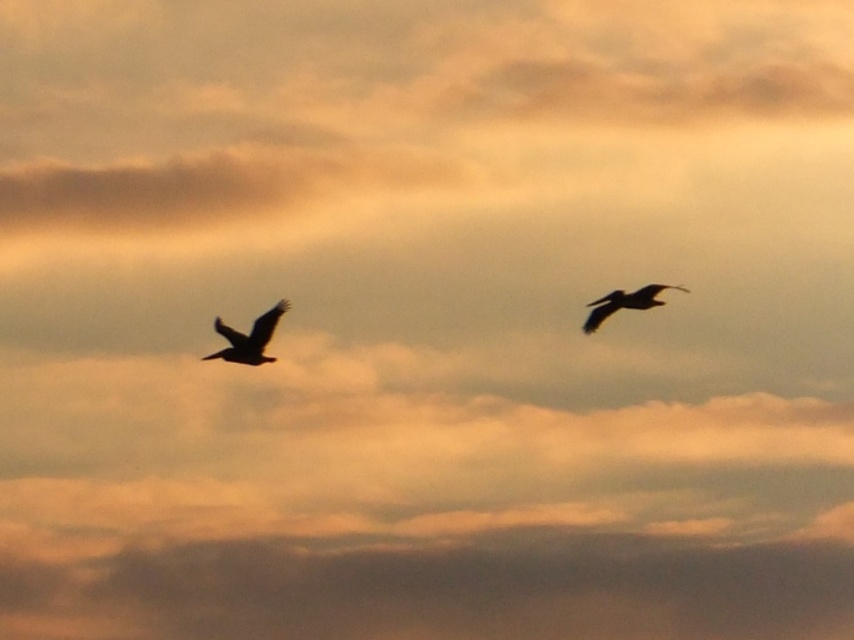
Question: Which point is farther to the camera?

Choices:
 (A) silhouette feathered bird at left
 (B) dark feathered bird at upper right

Answer: (B)

Question: Can you confirm if silhouette feathered bird at left is positioned below dark feathered bird at upper right?

Choices:
 (A) no
 (B) yes

Answer: (B)

Question: Considering the relative positions of silhouette feathered bird at left and dark feathered bird at upper right in the image provided, where is silhouette feathered bird at left located with respect to dark feathered bird at upper right?

Choices:
 (A) left
 (B) right

Answer: (A)

Question: Among these objects, which one is nearest to the camera?

Choices:
 (A) silhouette feathered bird at left
 (B) dark feathered bird at upper right

Answer: (A)

Question: Is silhouette feathered bird at left to the right of dark feathered bird at upper right from the viewer's perspective?

Choices:
 (A) yes
 (B) no

Answer: (B)